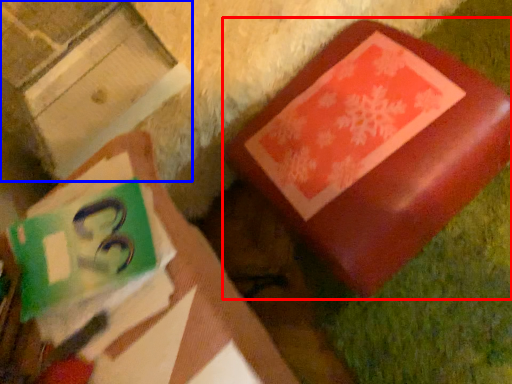
Question: Among these objects, which one is nearest to the camera, furniture (highlighted by a red box) or cardboard box (highlighted by a blue box)?

Choices:
 (A) furniture
 (B) cardboard box

Answer: (B)